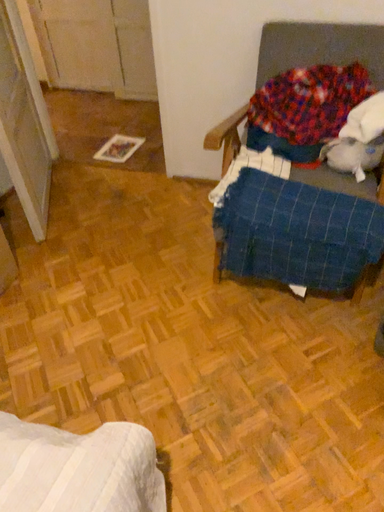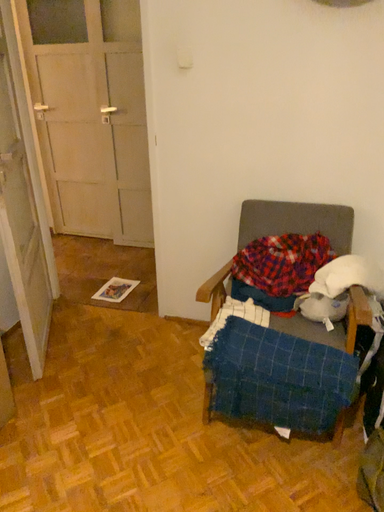
Question: How did the camera likely rotate when shooting the video?

Choices:
 (A) rotated upward
 (B) rotated downward

Answer: (A)